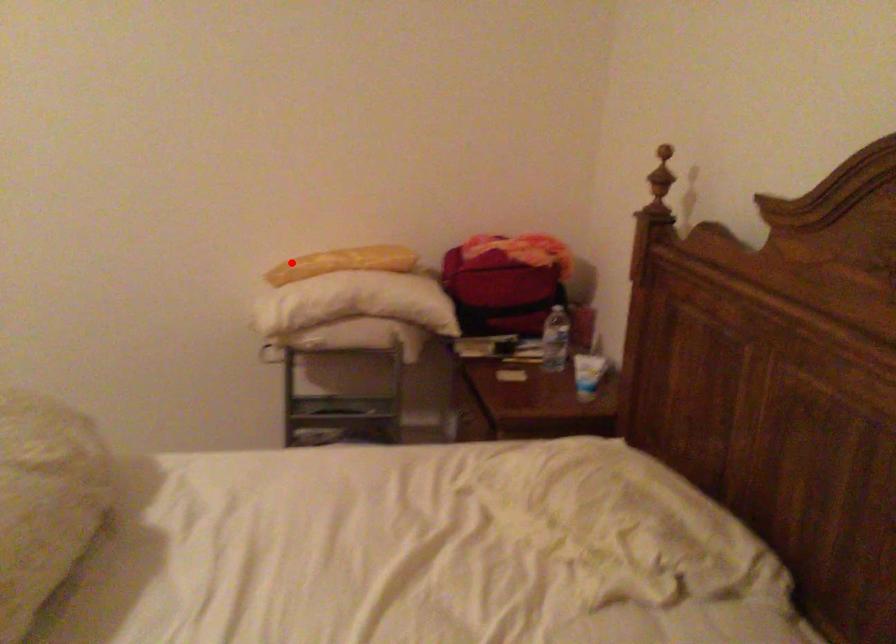
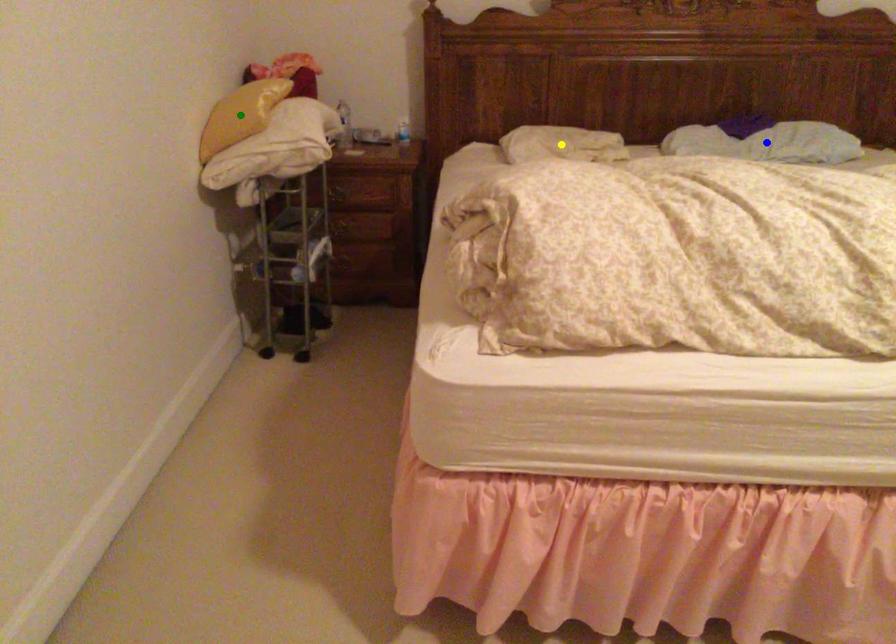
Question: I am providing you with two images of the same scene from different viewpoints. A red point is marked on the first image. You are given multiple points on the second image. Which point in image 2 represents the same 3d spot as the red point in image 1?

Choices:
 (A) yellow point
 (B) blue point
 (C) green point

Answer: (C)